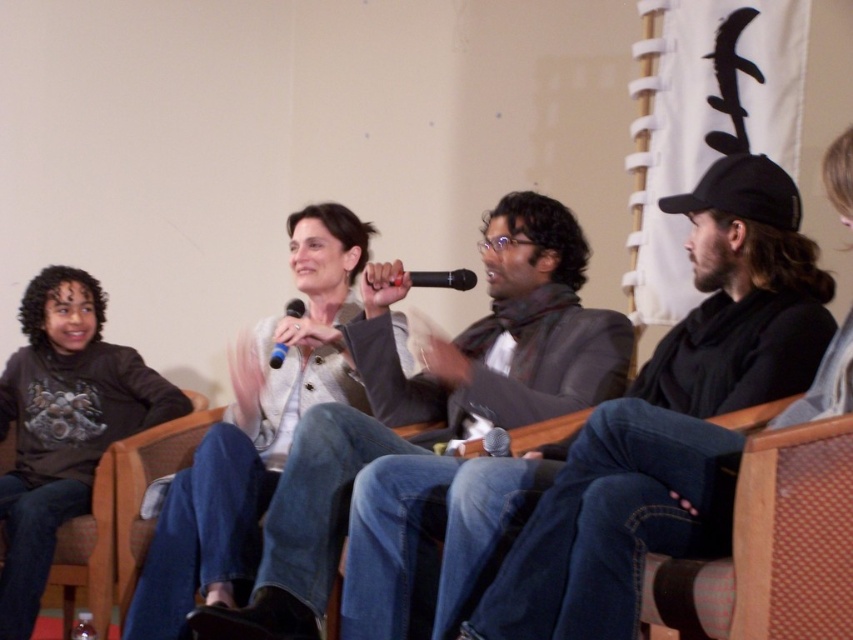
Is white textured sweater at center wider than blue matte microphone at center?

Yes, white textured sweater at center is wider than blue matte microphone at center.

Who is more forward, (360, 237) or (276, 349)?

Positioned in front is point (276, 349).

At what (x,y) coordinates should I click in order to perform the action: click on white textured sweater at center. Please return your answer as a coordinate pair (x, y). Image resolution: width=853 pixels, height=640 pixels. Looking at the image, I should click on (253, 433).

Which is in front, point (759, 372) or point (456, 288)?

Point (759, 372)

Can you confirm if dark gray sweater at center is positioned to the left of black matte microphone at center?

Incorrect, dark gray sweater at center is not on the left side of black matte microphone at center.

Does point (758, 208) come closer to viewer compared to point (415, 285)?

Yes, point (758, 208) is in front of point (415, 285).

The width and height of the screenshot is (853, 640). I want to click on dark gray sweater at center, so click(741, 296).

Does dark gray sweater at center appear over white textured sweater at center?

Yes, dark gray sweater at center is above white textured sweater at center.

Does point (753, 358) lie behind point (335, 376)?

No, it is not.

I want to click on dark gray sweater at center, so click(x=741, y=296).